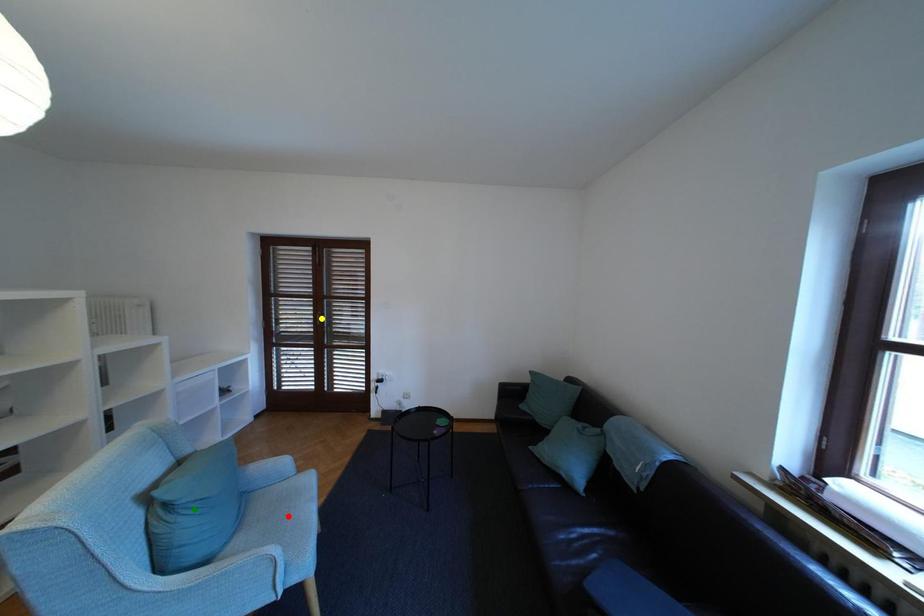
Order these from nearest to farthest:
green point, yellow point, red point

green point, red point, yellow point